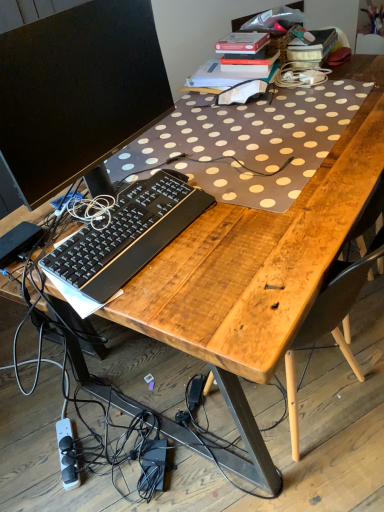
Identify the location of vacant area situated to the left side of white plastic power strip at lower left. The height and width of the screenshot is (512, 384). (25, 455).